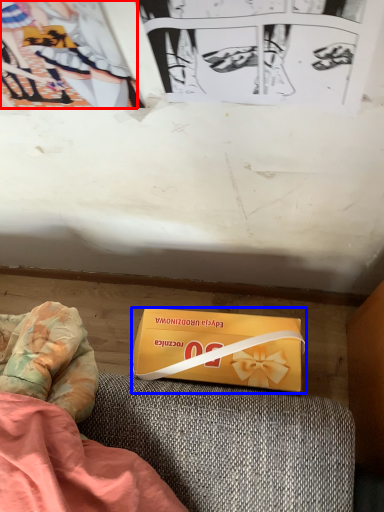
Question: Which object appears farthest to the camera in this image, couple (highlighted by a red box) or box (highlighted by a blue box)?

Choices:
 (A) couple
 (B) box

Answer: (B)